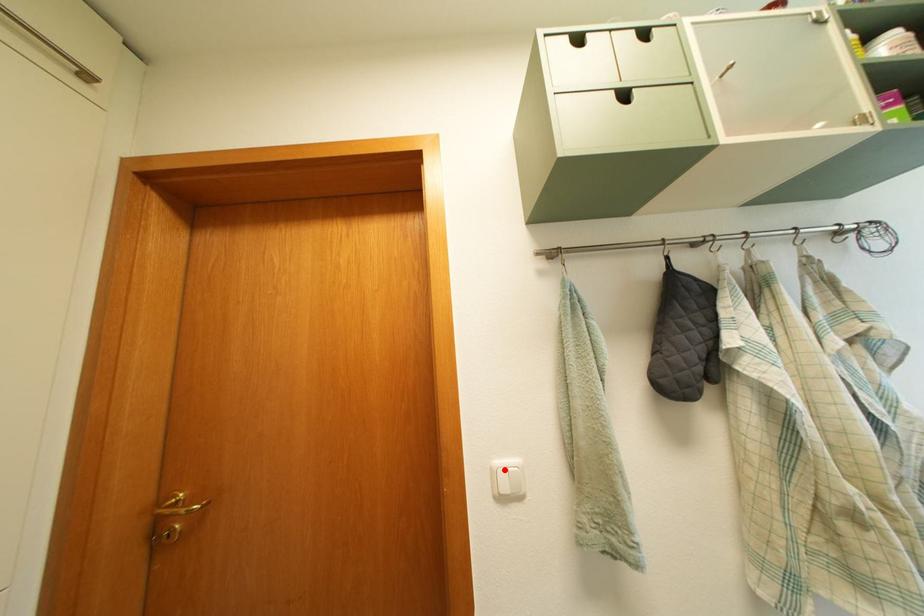
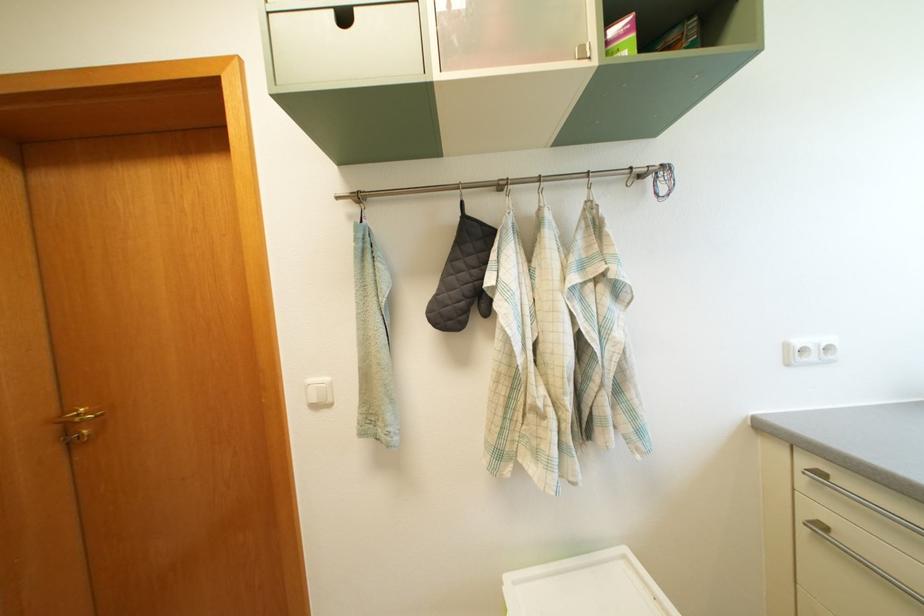
Locate, in the second image, the point that corresponds to the highlighted location in the first image.

(318, 387)